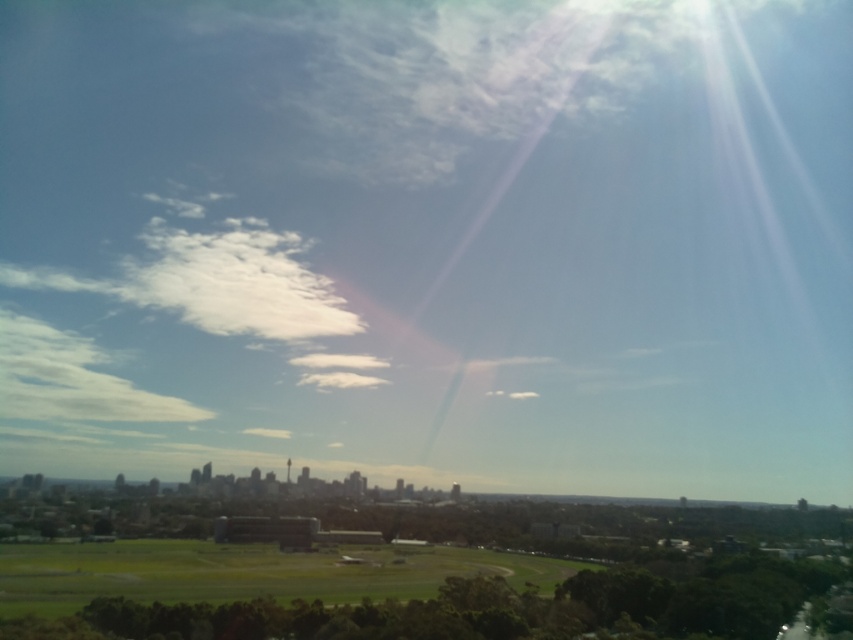
You are standing at the center of the city park. You want to find the green grassy field at lower left. Which direction should you walk to reach it?

To reach the green grassy field at lower left, you should walk towards the lower left direction from your current position at the center of the city park.

You are a city planner analyzing the image. You need to determine the spatial relationship between the green grassy field at lower left and the white fluffy cloud at upper left. Which object occupies a larger area in the image?

The green grassy field at lower left occupies a larger area in the image than the white fluffy cloud at upper left, as its width is greater according to the description.

You are a drone operator who needs to fly a drone from the green grassy field at lower left to the white fluffy cloud at upper left. What is the approximate distance you need to cover?

The approximate distance between the green grassy field at lower left and the white fluffy cloud at upper left is 294.18 meters.